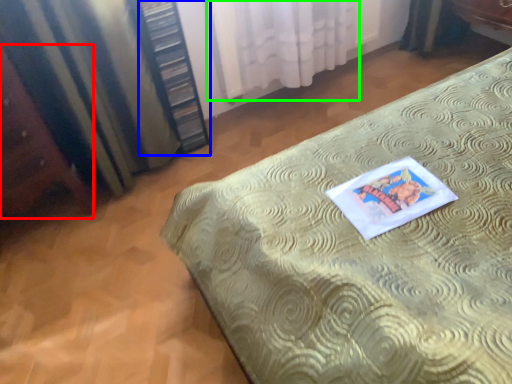
Question: Considering the real-world distances, which object is farthest from vanity (highlighted by a red box)? bookshelf (highlighted by a blue box) or curtain (highlighted by a green box)?

Choices:
 (A) bookshelf
 (B) curtain

Answer: (B)